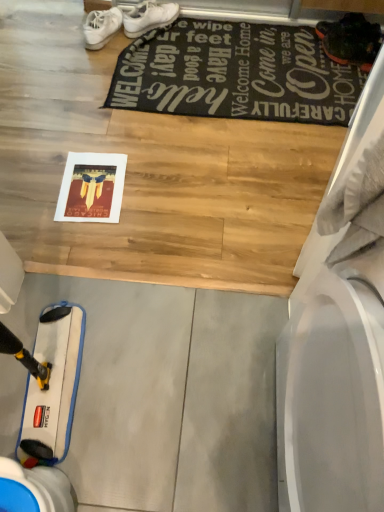
The image size is (384, 512). Describe the element at coordinates (244, 71) in the screenshot. I see `black fabric mat at upper center` at that location.

Locate an element on the screen. The height and width of the screenshot is (512, 384). black fabric mat at upper center is located at coordinates (244, 71).

In order to face white matte sneakers at upper center, should I rotate leftwards or rightwards?

Turn left approximately 8.191 degrees to face it.

What do you see at coordinates (127, 22) in the screenshot?
I see `white matte sneakers at upper center` at bounding box center [127, 22].

You are a GUI agent. You are given a task and a screenshot of the screen. Output one action in this format:
    pyautogui.click(x=<x>, y=<y>)
    Task: Click on the white matte sneakers at upper center
    This screenshot has width=384, height=512.
    Given the screenshot: What is the action you would take?
    pyautogui.click(x=127, y=22)

This screenshot has width=384, height=512. Identify the location of black fabric mat at upper center. (244, 71).

Considering the positions of objects black fabric mat at upper center and white matte sneakers at upper center in the image provided, who is more to the right, black fabric mat at upper center or white matte sneakers at upper center?

black fabric mat at upper center is more to the right.

Which object is further away from the camera taking this photo, black fabric mat at upper center or white matte sneakers at upper center?

white matte sneakers at upper center is behind.

Considering the positions of point (125, 93) and point (142, 4), is point (125, 93) closer or farther from the camera than point (142, 4)?

Point (125, 93) is positioned closer to the camera compared to point (142, 4).

From the image's perspective, which is above, black fabric mat at upper center or white matte sneakers at upper center?

white matte sneakers at upper center is shown above in the image.

From a real-world perspective, relative to white matte sneakers at upper center, is black fabric mat at upper center vertically above or below?

In terms of real-world spatial position, black fabric mat at upper center is below white matte sneakers at upper center.

Can you confirm if black fabric mat at upper center is wider than white matte sneakers at upper center?

Yes, black fabric mat at upper center is wider than white matte sneakers at upper center.

Is black fabric mat at upper center taller than white matte sneakers at upper center?

No.

Which of these two, black fabric mat at upper center or white matte sneakers at upper center, is smaller?

With smaller size is white matte sneakers at upper center.

Consider the image. Is black fabric mat at upper center inside or outside of white matte sneakers at upper center?

black fabric mat at upper center is outside white matte sneakers at upper center.

Is black fabric mat at upper center far from white matte sneakers at upper center?

No, black fabric mat at upper center is not far away from white matte sneakers at upper center.

Is black fabric mat at upper center facing towards white matte sneakers at upper center?

No, black fabric mat at upper center does not turn towards white matte sneakers at upper center.

Where is `footwear that is behind the black fabric mat at upper center`? The height and width of the screenshot is (512, 384). footwear that is behind the black fabric mat at upper center is located at coordinates (127, 22).

Does white matte sneakers at upper center appear on the right side of black fabric mat at upper center?

In fact, white matte sneakers at upper center is to the left of black fabric mat at upper center.

Considering the positions of objects white matte sneakers at upper center and black fabric mat at upper center in the image provided, who is behind, white matte sneakers at upper center or black fabric mat at upper center?

white matte sneakers at upper center is behind.

Does point (117, 22) come farther from viewer compared to point (282, 37)?

No, it is in front of (282, 37).

From the image's perspective, is white matte sneakers at upper center located beneath black fabric mat at upper center?

No.

From a real-world perspective, between white matte sneakers at upper center and black fabric mat at upper center, who is vertically lower?

black fabric mat at upper center.

In the scene shown: Is white matte sneakers at upper center thinner than black fabric mat at upper center?

Yes.

Between white matte sneakers at upper center and black fabric mat at upper center, which one has more height?

Standing taller between the two is white matte sneakers at upper center.

Which of these two, white matte sneakers at upper center or black fabric mat at upper center, is smaller?

Smaller between the two is white matte sneakers at upper center.

Is white matte sneakers at upper center situated inside black fabric mat at upper center or outside?

white matte sneakers at upper center exists entirely within black fabric mat at upper center.

Is white matte sneakers at upper center in contact with black fabric mat at upper center?

No, white matte sneakers at upper center is not making contact with black fabric mat at upper center.

Could you tell me if white matte sneakers at upper center is turned towards black fabric mat at upper center?

Yes, white matte sneakers at upper center is aimed at black fabric mat at upper center.

How many degrees apart are the facing directions of white matte sneakers at upper center and black fabric mat at upper center?

There is a 2.17e-05-degree angle between the facing directions of white matte sneakers at upper center and black fabric mat at upper center.

This screenshot has height=512, width=384. I want to click on mat located in front of the white matte sneakers at upper center, so click(244, 71).

Identify the location of mat lying in front of the white matte sneakers at upper center. (244, 71).

Where is `footwear that is above the black fabric mat at upper center (from a real-world perspective)`? footwear that is above the black fabric mat at upper center (from a real-world perspective) is located at coordinates (127, 22).